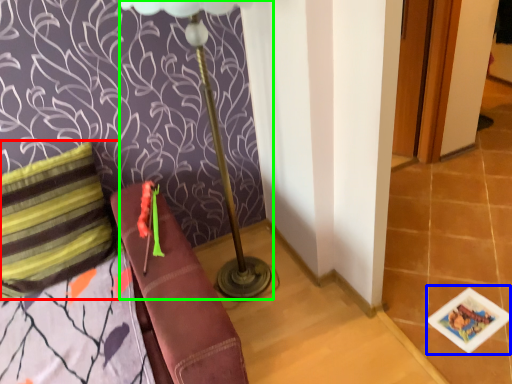
Question: Estimate the real-world distances between objects in this image. Which object is farther from pillow (highlighted by a red box), card game (highlighted by a blue box) or table lamp (highlighted by a green box)?

Choices:
 (A) card game
 (B) table lamp

Answer: (A)